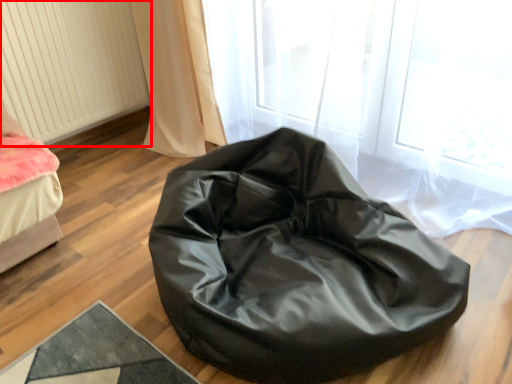
Question: Observing the image, what is the correct spatial positioning of radiator (annotated by the red box) in reference to furniture?

Choices:
 (A) right
 (B) left

Answer: (B)